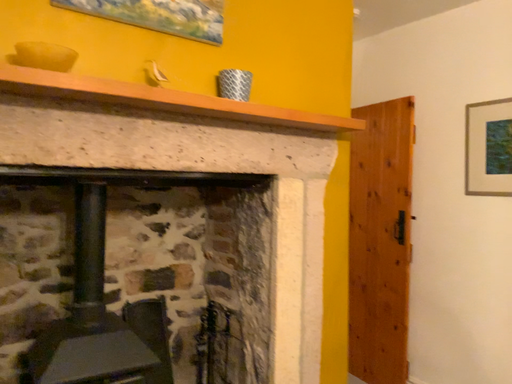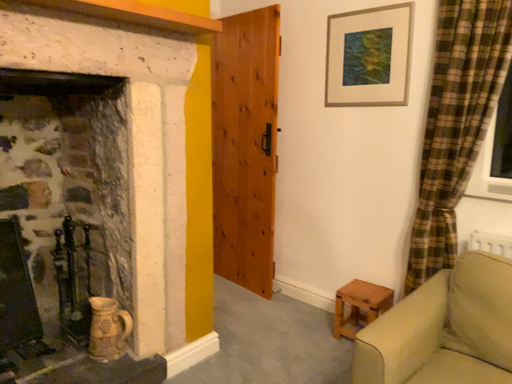
Question: Which way did the camera rotate in the video?

Choices:
 (A) rotated upward
 (B) rotated downward

Answer: (B)